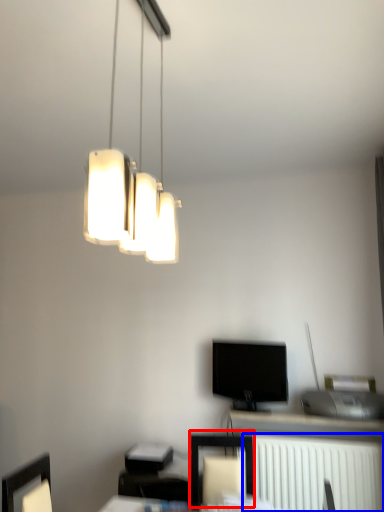
Question: Which object is closer to the camera taking this photo, furniture (highlighted by a red box) or radiator (highlighted by a blue box)?

Choices:
 (A) furniture
 (B) radiator

Answer: (A)